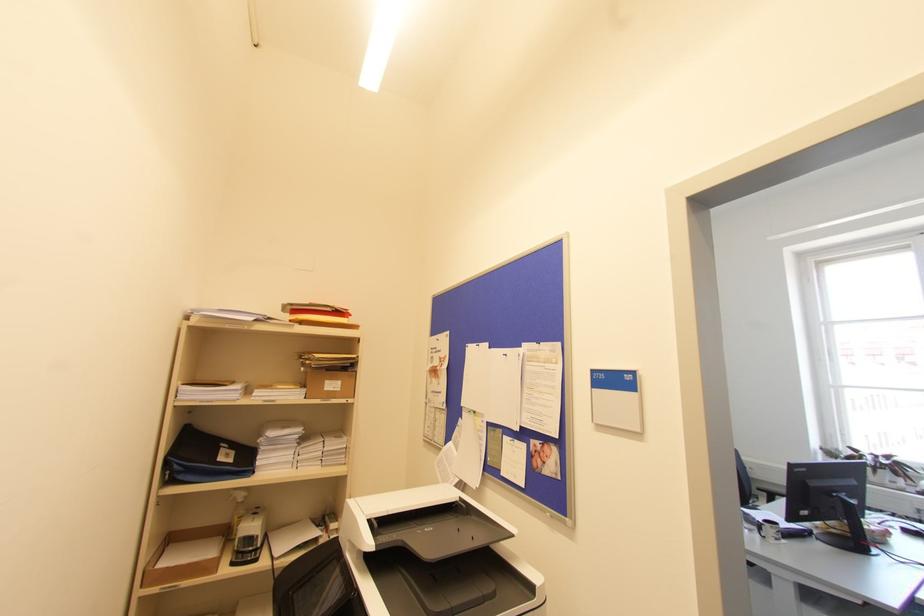
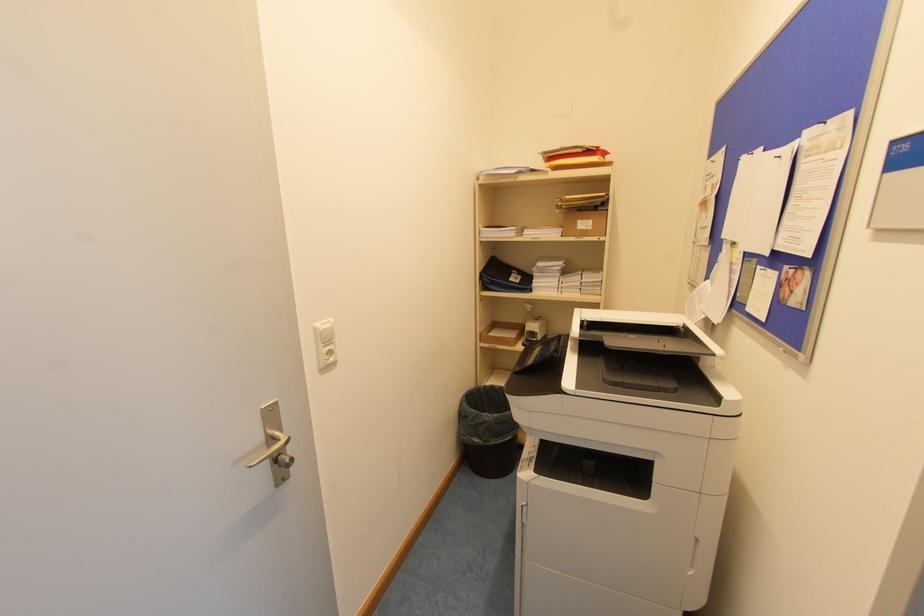
Where in the second image is the point corresponding to (471,538) from the first image?

(663, 346)